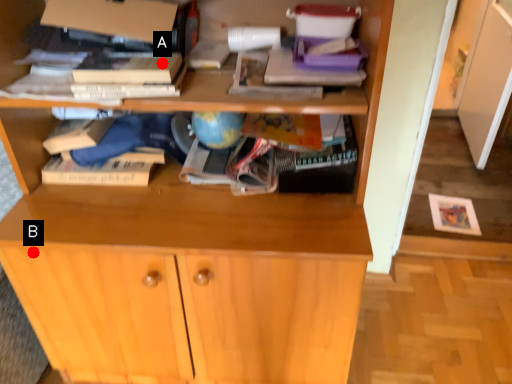
Question: Two points are circled on the image, labeled by A and B beside each circle. Which point appears closest to the camera in this image?

Choices:
 (A) A is closer
 (B) B is closer

Answer: (A)